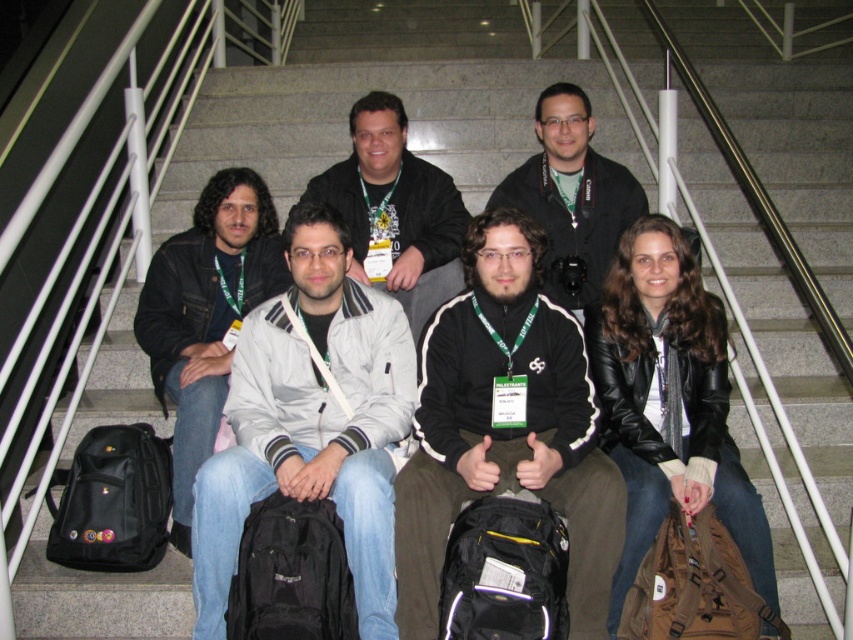
Is light gray fabric jacket at center smaller than black leather jacket at lower right?

No, light gray fabric jacket at center is not smaller than black leather jacket at lower right.

Consider the image. Is light gray fabric jacket at center wider than black leather jacket at lower right?

Indeed, light gray fabric jacket at center has a greater width compared to black leather jacket at lower right.

At what (x,y) coordinates should I click in order to perform the action: click on light gray fabric jacket at center. Please return your answer as a coordinate pair (x, y). Looking at the image, I should click on (311, 422).

Between point (544, 413) and point (402, 220), which one is positioned behind?

Positioned behind is point (402, 220).

Is black fleece jacket at center smaller than matte black jacket at center?

Actually, black fleece jacket at center might be larger than matte black jacket at center.

You are a GUI agent. You are given a task and a screenshot of the screen. Output one action in this format:
    pyautogui.click(x=<x>, y=<y>)
    Task: Click on the black fleece jacket at center
    Image resolution: width=853 pixels, height=640 pixels.
    Given the screenshot: What is the action you would take?
    pyautogui.click(x=505, y=428)

Locate an element on the screen. This screenshot has width=853, height=640. black fleece jacket at center is located at coordinates (505, 428).

Which is in front, point (654, 292) or point (596, 244)?

Positioned in front is point (654, 292).

Can you confirm if black leather jacket at lower right is positioned above black leather jacket at center?

No, black leather jacket at lower right is not above black leather jacket at center.

Does point (648, 384) come closer to viewer compared to point (601, 243)?

Yes, point (648, 384) is in front of point (601, 243).

Locate an element on the screen. Image resolution: width=853 pixels, height=640 pixels. black leather jacket at lower right is located at coordinates (669, 403).